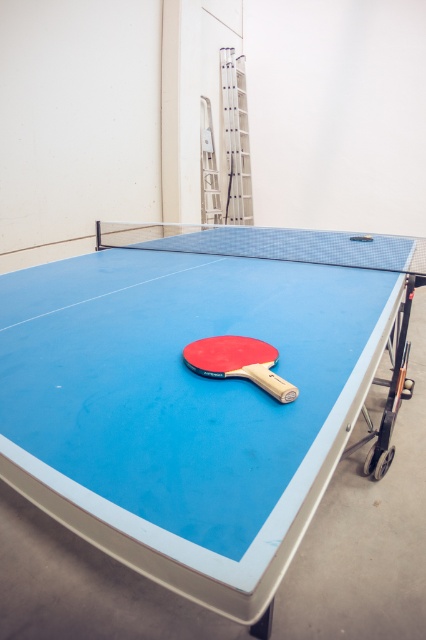
You are playing ping pong and see the blue rubber table at center and the red matte table tennis racket at center. Which object is positioned lower in the scene?

The blue rubber table at center is located below the red matte table tennis racket at center, so the blue rubber table at center is positioned lower.

Based on the photo, you are a ping pong player who wants to place the red matte table tennis racket at center on top of the blue rubber table at center. Is this possible based on their sizes?

The blue rubber table at center has a greater height compared to the red matte table tennis racket at center. Therefore, the racket can be placed on top of the table since the table is taller than the racket.